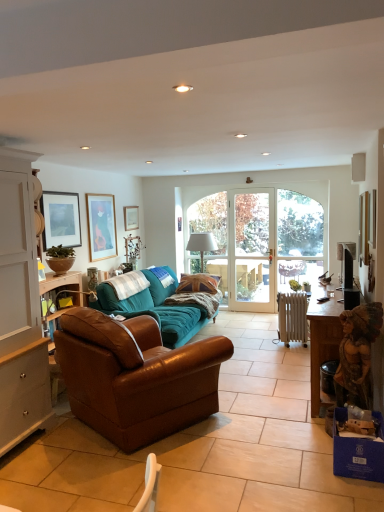
This screenshot has height=512, width=384. I want to click on vacant area that lies to the right of white wood cabinet at left, so click(65, 452).